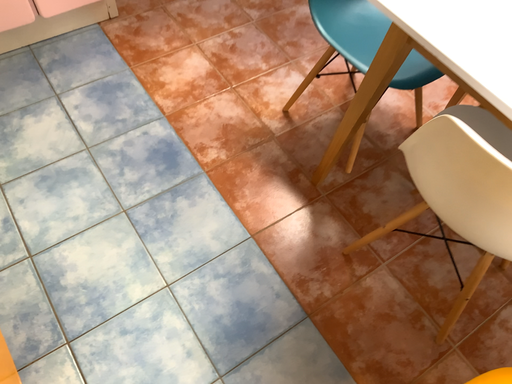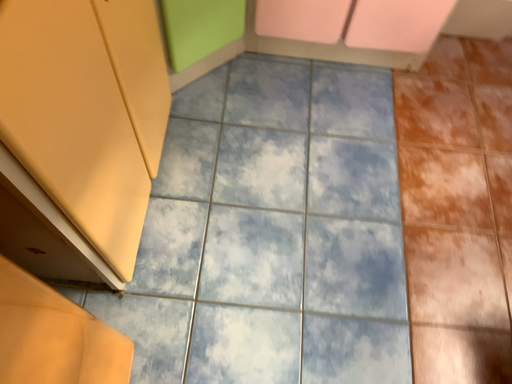
Question: How did the camera likely rotate when shooting the video?

Choices:
 (A) rotated left
 (B) rotated right

Answer: (A)